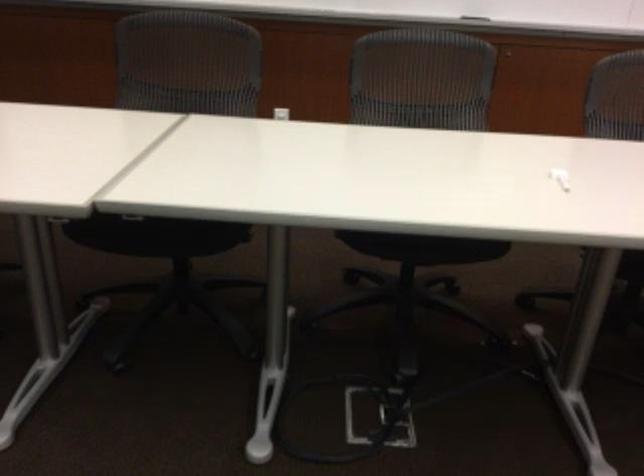
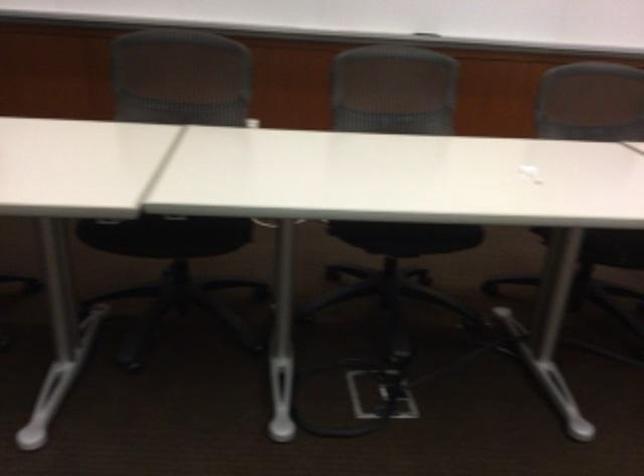
Where in the second image is the point corresponding to (x=152, y=232) from the first image?

(166, 235)